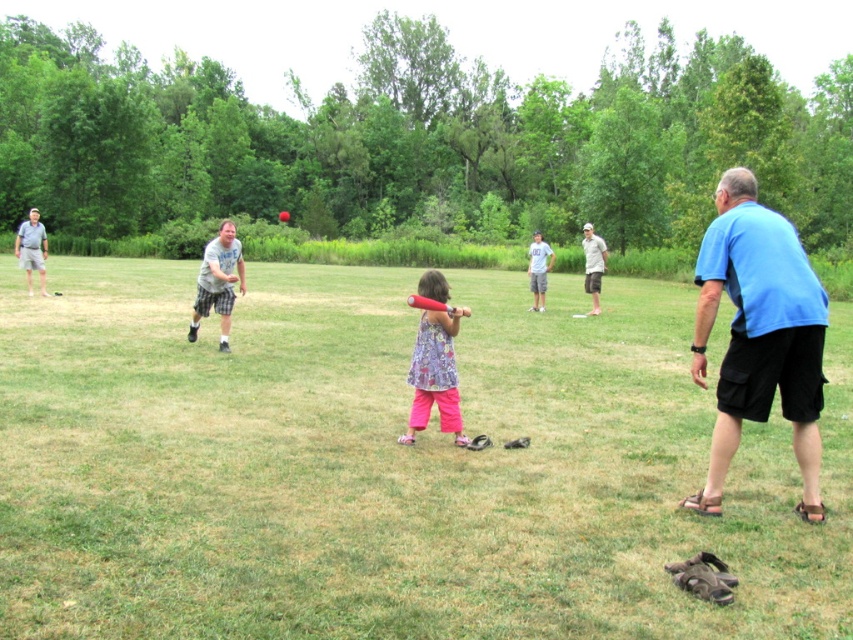
You are a photographer trying to capture a closeup of the rubberized pink bat at center. The floral fabric dress at center is blocking your view. Can you estimate if the dress is wider than the bat?

The floral fabric dress at center might be wider than rubberized pink bat at center, so there is a possibility that the dress is blocking the view of the bat.